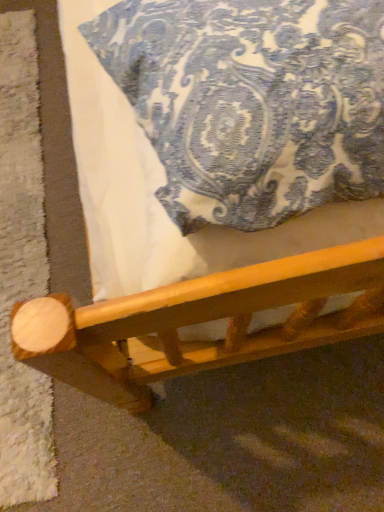
Locate an element on the screen. The width and height of the screenshot is (384, 512). satin blue pillow at upper center is located at coordinates (252, 102).

Measure the distance between point (152, 61) and camera.

They are 19.21 inches apart.

Describe the element at coordinates (252, 102) in the screenshot. I see `satin blue pillow at upper center` at that location.

Where is `satin blue pillow at upper center`? This screenshot has width=384, height=512. satin blue pillow at upper center is located at coordinates (252, 102).